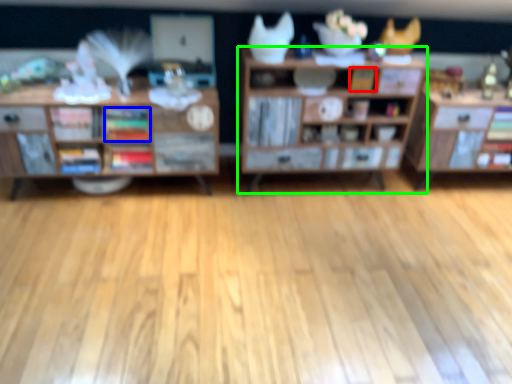
Question: Which object is positioned farthest from book (highlighted by a red box)? Select from book (highlighted by a blue box) and shelf (highlighted by a green box).

Choices:
 (A) book
 (B) shelf

Answer: (A)